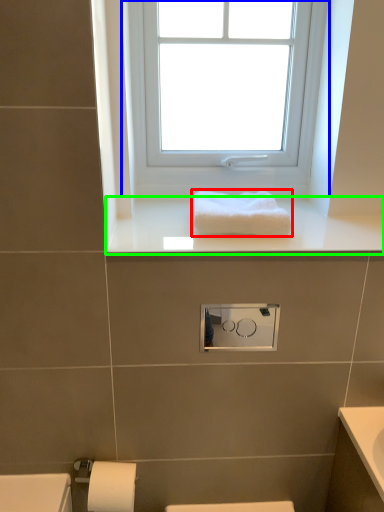
Question: Which object is positioned closest to towel (highlighted by a red box)? Select from window (highlighted by a blue box) and window sill (highlighted by a green box).

Choices:
 (A) window
 (B) window sill

Answer: (B)